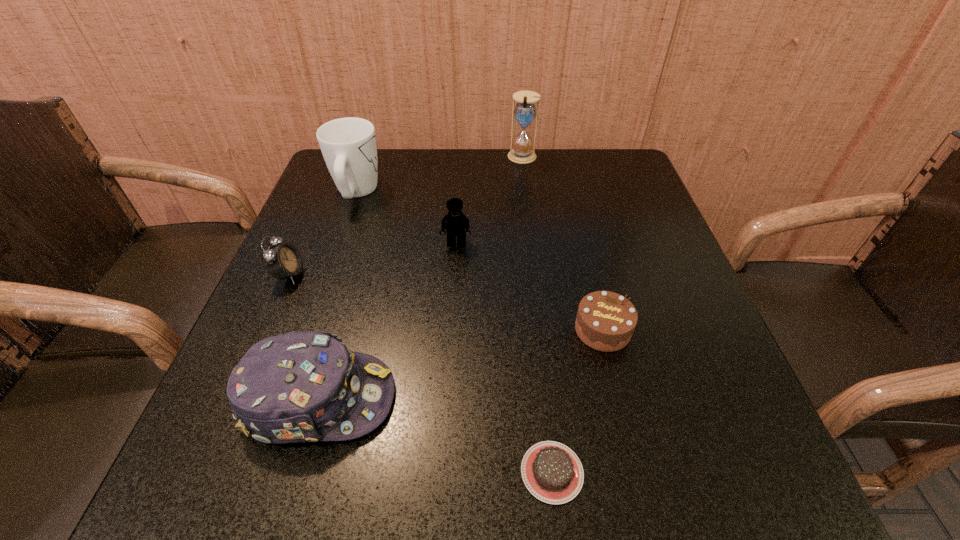
Locate an element on the screen. The width and height of the screenshot is (960, 540). vacant space that satisfies the following two spatial constraints: 1. on the front side of the hourglass; 2. on the front-facing side of the headwear is located at coordinates (554, 399).

Where is `free space that satisfies the following two spatial constraints: 1. on the face of the fourth farthest object; 2. on the left side of the rightmost object`? The height and width of the screenshot is (540, 960). free space that satisfies the following two spatial constraints: 1. on the face of the fourth farthest object; 2. on the left side of the rightmost object is located at coordinates (266, 330).

Locate an element on the screen. This screenshot has width=960, height=540. free space that satisfies the following two spatial constraints: 1. on the back side of the farther chocolate cake; 2. on the face of the fourth nearest object is located at coordinates (589, 275).

Identify the location of blank space that satisfies the following two spatial constraints: 1. on the front-facing side of the shorter chocolate cake; 2. on the left side of the headwear. This screenshot has height=540, width=960. (300, 472).

Locate an element on the screen. The height and width of the screenshot is (540, 960). vacant position in the image that satisfies the following two spatial constraints: 1. on the face of the nearer chocolate cake; 2. on the right side of the fifth tallest object is located at coordinates (204, 472).